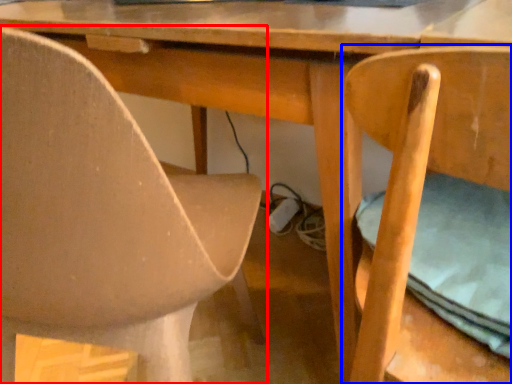
Question: Among these objects, which one is farthest to the camera, chair (highlighted by a red box) or chair (highlighted by a blue box)?

Choices:
 (A) chair
 (B) chair

Answer: (A)